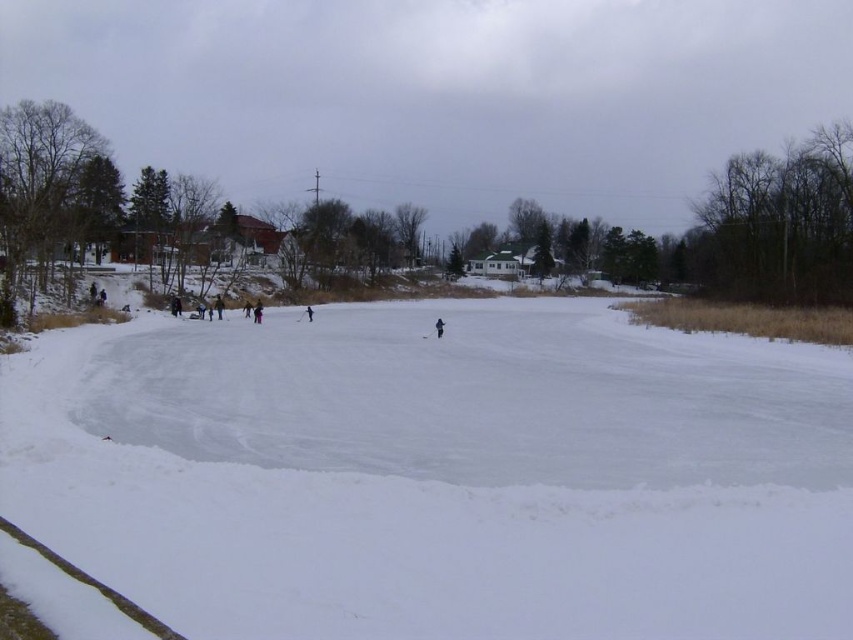
You are standing on the frozen pond and see a black snowsuit at center and a black matte skier at center. Which one is closer to you?

The black snowsuit at center is closer to you because the black matte skier at center is behind it.

You are standing at the bottom of the image and want to locate the dark blue jacket at center. In which direction should you look to find it?

The dark blue jacket at center is located at point 0.480 on the horizontal axis and 0.257 on the vertical axis. Since you are at the bottom, looking upwards would bring you closer to the jacket.

You are standing on the frozen pond and see the dark blue jacket at center and the black matte skier at center. Which object is closer to you?

The dark blue jacket at center is closer to you because it is further to the viewer than the black matte skier at center.